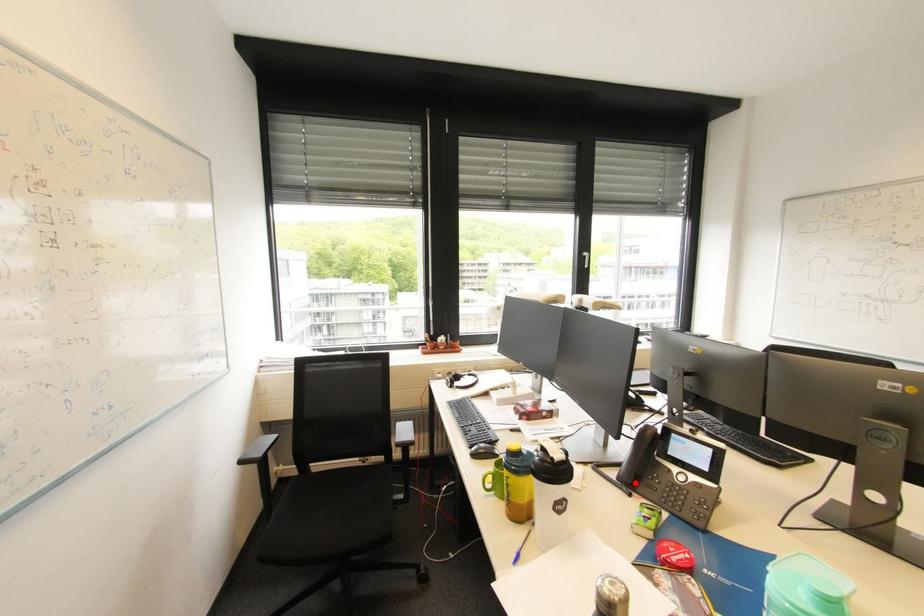
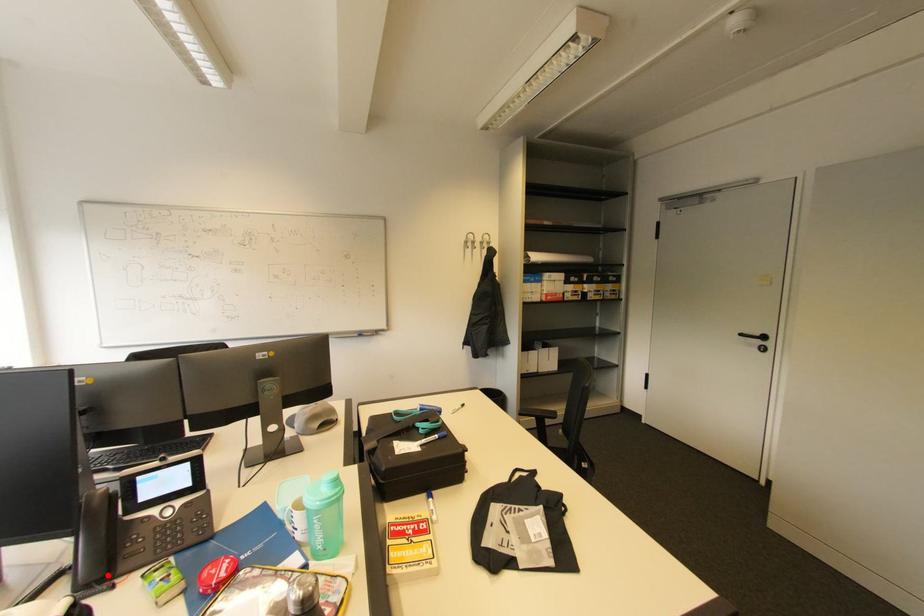
I am providing you with two images of the same scene from different viewpoints. A red point is marked on the first image and another point is marked on the second image. Is the red point in image1 aligned with the point shown in image2?

Yes